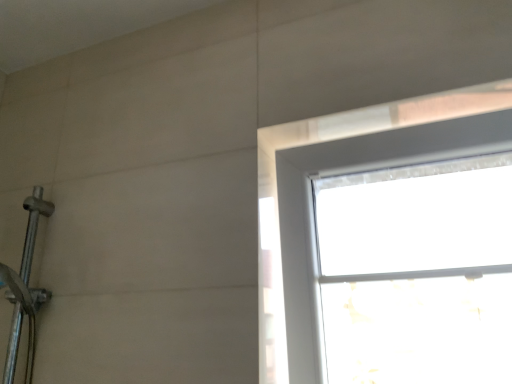
Locate an element on the screen. silver metallic shower handle at left is located at coordinates (25, 288).

What do you see at coordinates (25, 288) in the screenshot? I see `silver metallic shower handle at left` at bounding box center [25, 288].

At what (x,y) coordinates should I click in order to perform the action: click on silver metallic shower handle at left. Please return your answer as a coordinate pair (x, y). The width and height of the screenshot is (512, 384). Looking at the image, I should click on (25, 288).